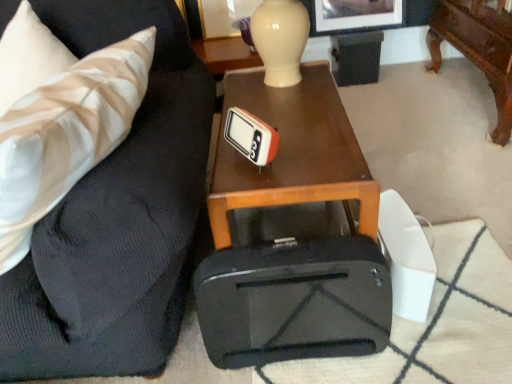
Question: Considering the relative sizes of white striped fabric pillow at left and white plastic thermometer at center in the image provided, is white striped fabric pillow at left thinner than white plastic thermometer at center?

Choices:
 (A) no
 (B) yes

Answer: (A)

Question: From a real-world perspective, is white striped fabric pillow at left physically above white plastic thermometer at center?

Choices:
 (A) yes
 (B) no

Answer: (A)

Question: Can white plastic thermometer at center be found inside white striped fabric pillow at left?

Choices:
 (A) no
 (B) yes

Answer: (A)

Question: Does white striped fabric pillow at left appear on the left side of white plastic thermometer at center?

Choices:
 (A) yes
 (B) no

Answer: (A)

Question: Is white striped fabric pillow at left completely or partially outside of white plastic thermometer at center?

Choices:
 (A) yes
 (B) no

Answer: (A)

Question: Is white striped fabric pillow at left oriented away from white plastic thermometer at center?

Choices:
 (A) yes
 (B) no

Answer: (B)

Question: Is white plastic thermometer at center wider than black matte suitcase at center?

Choices:
 (A) yes
 (B) no

Answer: (B)

Question: Can you confirm if white plastic thermometer at center is bigger than black matte suitcase at center?

Choices:
 (A) yes
 (B) no

Answer: (B)

Question: Could you tell me if white plastic thermometer at center is facing black matte suitcase at center?

Choices:
 (A) no
 (B) yes

Answer: (A)

Question: Are white plastic thermometer at center and black matte suitcase at center located far from each other?

Choices:
 (A) no
 (B) yes

Answer: (A)

Question: Is white plastic thermometer at center to the right of black matte suitcase at center from the viewer's perspective?

Choices:
 (A) yes
 (B) no

Answer: (B)

Question: Can you see white plastic thermometer at center touching black matte suitcase at center?

Choices:
 (A) no
 (B) yes

Answer: (A)

Question: Does black matte suitcase at center turn towards woodenobject at center?

Choices:
 (A) yes
 (B) no

Answer: (B)